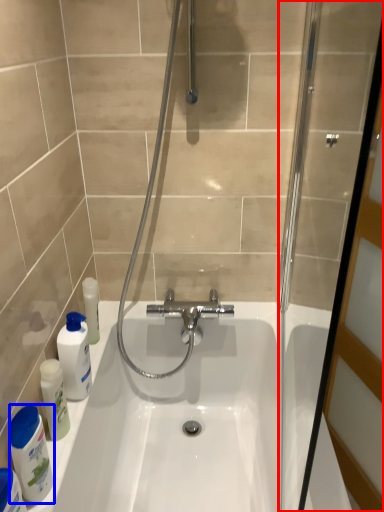
Question: Which object appears farthest to the camera in this image, screen door (highlighted by a red box) or cleaning product (highlighted by a blue box)?

Choices:
 (A) screen door
 (B) cleaning product

Answer: (B)